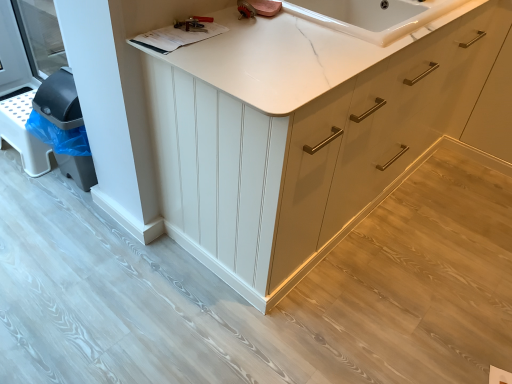
Question: From the image's perspective, relative to metallic silver wrench at upper center, is matte white cabinet at center above or below?

Choices:
 (A) above
 (B) below

Answer: (B)

Question: In terms of size, does matte white cabinet at center appear bigger or smaller than metallic silver wrench at upper center?

Choices:
 (A) small
 (B) big

Answer: (B)

Question: Which object is positioned farthest from the metallic silver wrench at upper center?

Choices:
 (A) matte white cabinet at center
 (B) white marble countertop at upper center

Answer: (A)

Question: Estimate the real-world distances between objects in this image. Which object is closer to the white marble countertop at upper center?

Choices:
 (A) matte white cabinet at center
 (B) metallic silver wrench at upper center

Answer: (A)